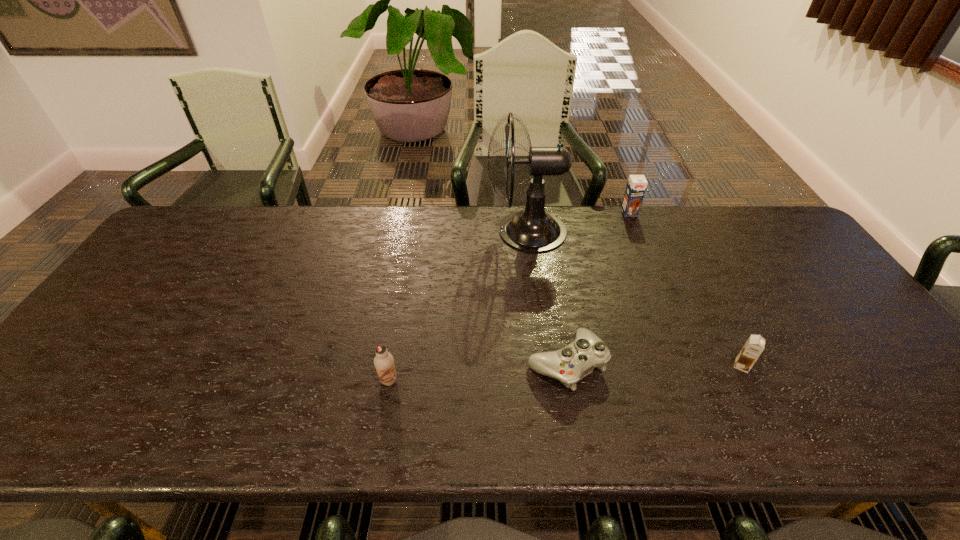
Find the location of a particular element. The image size is (960, 540). free space at the far left corner of the desktop is located at coordinates (206, 245).

Identify the location of empty space between the rightmost object and the control. (654, 364).

At what (x,y) coordinates should I click in order to perform the action: click on free area in between the shortest chocolate milk and the shortest object. Please return your answer as a coordinate pair (x, y). This screenshot has width=960, height=540. Looking at the image, I should click on (654, 364).

Where is `empty space that is in between the second shortest chocolate milk and the farthest chocolate milk`? This screenshot has height=540, width=960. empty space that is in between the second shortest chocolate milk and the farthest chocolate milk is located at coordinates (509, 296).

The height and width of the screenshot is (540, 960). I want to click on empty space between the control and the second shortest object, so click(654, 364).

Where is `free space between the second object from right to left and the fan`? The height and width of the screenshot is (540, 960). free space between the second object from right to left and the fan is located at coordinates (578, 222).

At what (x,y) coordinates should I click in order to perform the action: click on free space between the rightmost chocolate milk and the second chocolate milk from left to right. Please return your answer as a coordinate pair (x, y). Image resolution: width=960 pixels, height=540 pixels. Looking at the image, I should click on (685, 289).

Where is `unoccupied position between the control and the leftmost object`? This screenshot has width=960, height=540. unoccupied position between the control and the leftmost object is located at coordinates (477, 372).

In order to click on vacant area that lies between the shortest object and the tallest object in this screenshot , I will do `click(546, 297)`.

At what (x,y) coordinates should I click in order to perform the action: click on free area in between the second chocolate milk from left to right and the control. Please return your answer as a coordinate pair (x, y). Looking at the image, I should click on (598, 288).